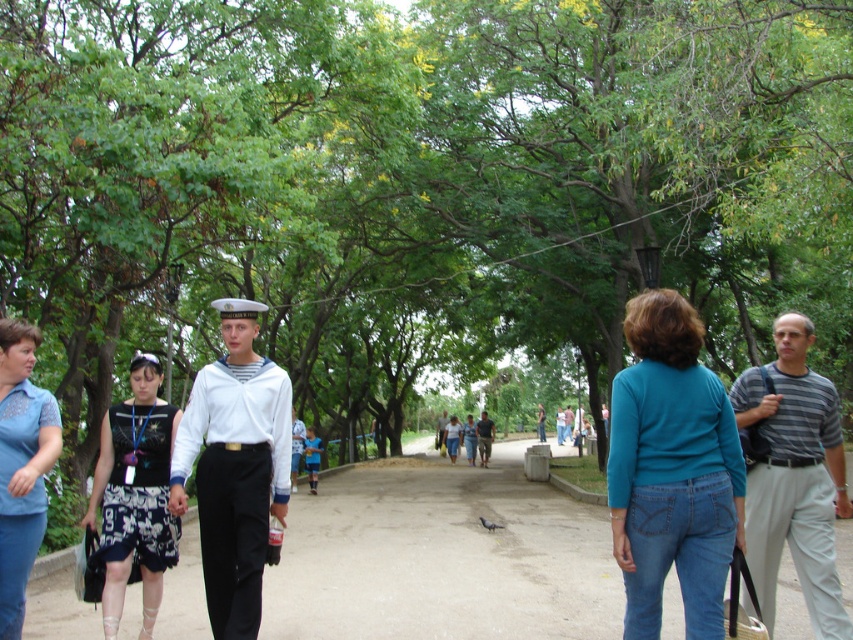
Question: Which of the following is the closest to the observer?

Choices:
 (A) (787, 417)
 (B) (0, 618)

Answer: (B)

Question: Which of these objects is positioned closest to the white cotton sailor suit at center?

Choices:
 (A) black printed dress at left
 (B) denim skirt at center

Answer: (A)

Question: Can you confirm if white matte uniform at center is smaller than blue denim jeans at lower left?

Choices:
 (A) no
 (B) yes

Answer: (A)

Question: Which point is farther from the camera taking this photo?

Choices:
 (A) (32, 365)
 (B) (480, 460)

Answer: (B)

Question: Is white cotton sailor suit at center wider than denim skirt at center?

Choices:
 (A) no
 (B) yes

Answer: (B)

Question: From the image, what is the correct spatial relationship of gray striped shirt at right in relation to blue denim jeans at lower left?

Choices:
 (A) below
 (B) above

Answer: (A)